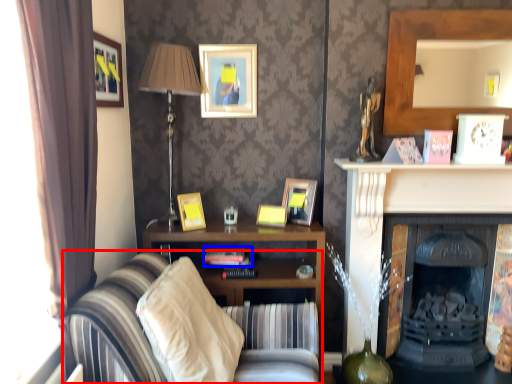
Question: Which of the following is the farthest to the observer, studio couch (highlighted by a red box) or book (highlighted by a blue box)?

Choices:
 (A) studio couch
 (B) book

Answer: (B)